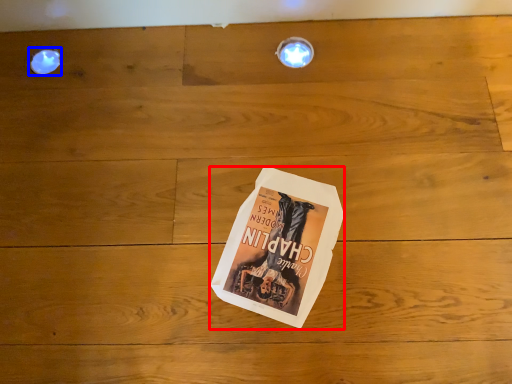
Question: Which point is closer to the camera, paperback book (highlighted by a red box) or droplight (highlighted by a blue box)?

Choices:
 (A) paperback book
 (B) droplight

Answer: (A)